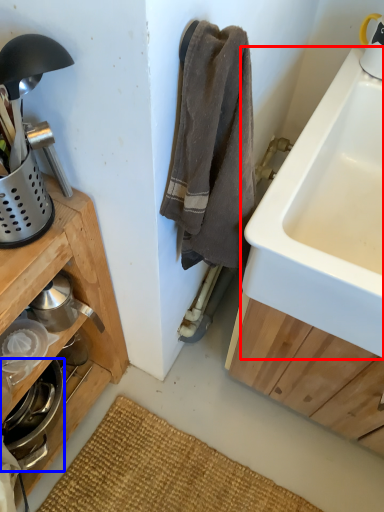
Question: Among these objects, which one is farthest to the camera, sink (highlighted by a red box) or appliance (highlighted by a blue box)?

Choices:
 (A) sink
 (B) appliance

Answer: (B)